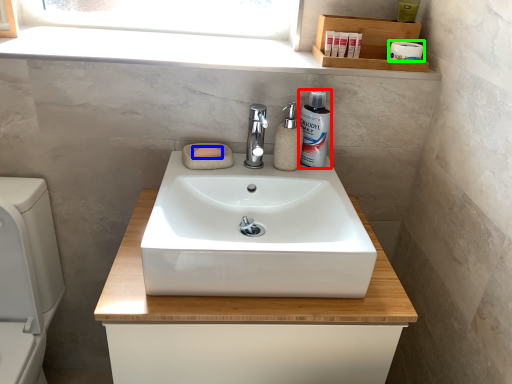
Question: Which object is the farthest from mouthwash (highlighted by a red box)? Choose among these: soap (highlighted by a blue box) or toilet paper (highlighted by a green box).

Choices:
 (A) soap
 (B) toilet paper

Answer: (B)